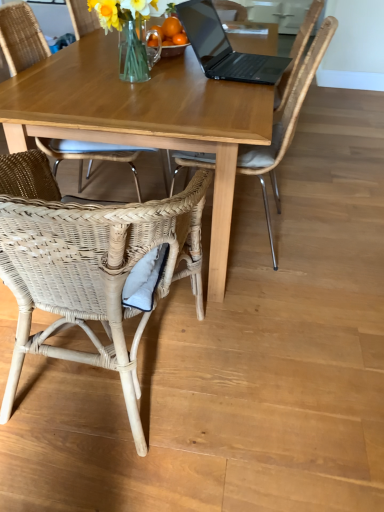
Identify the location of vacant space in front of woven rattan chair at upper center, the first chair when ordered from right to left. (292, 321).